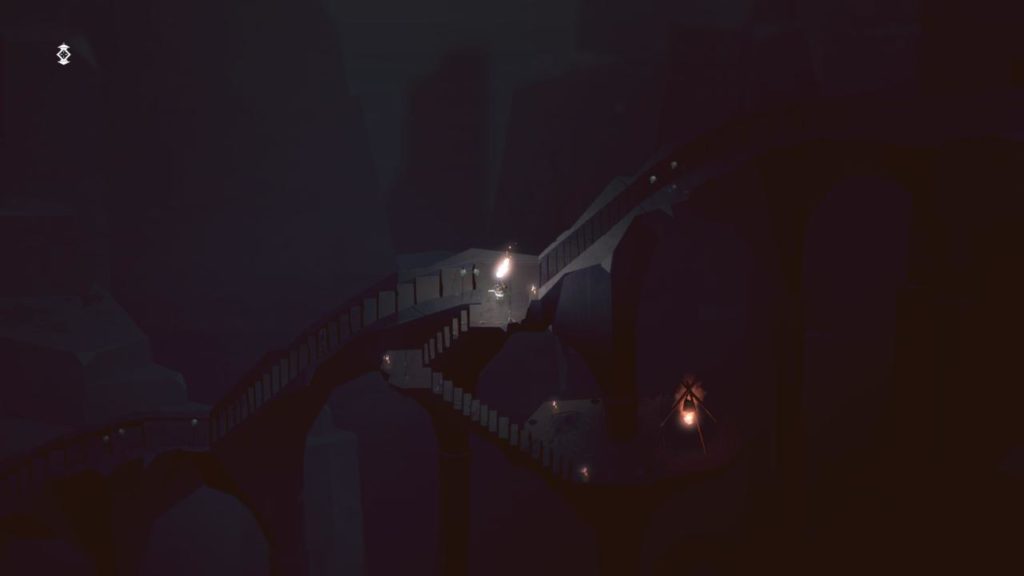
The image size is (1024, 576). I want to click on space below bulb, so click(x=690, y=485).